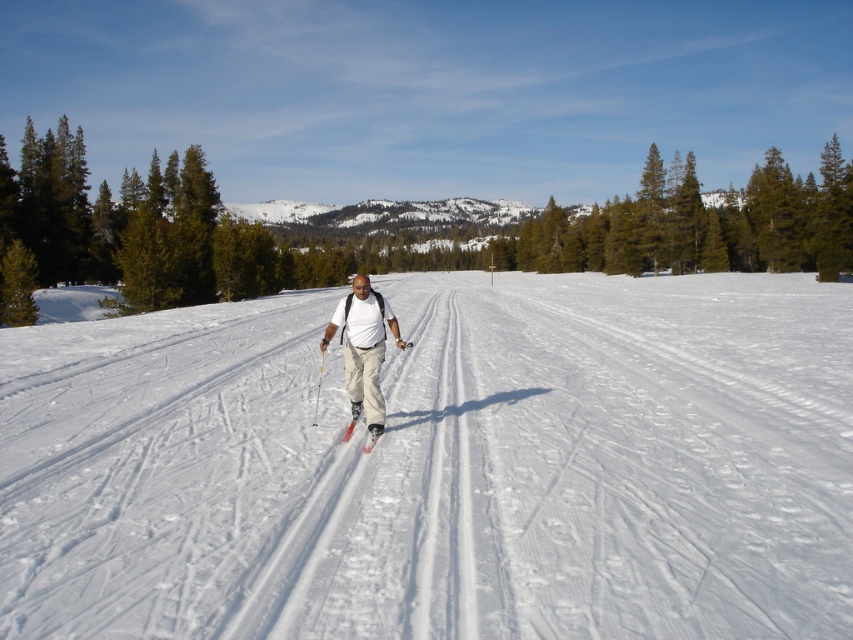
You are standing at the starting point of the cross country skiing trail. You see two points marked on the trail ahead of you. One is at point coordinates point (389, 308) and the other is at point (383, 426). Which point is closer to you?

Point (383, 426) is closer to you because it is less far from the camera than point (389, 308).

You are a photographer standing at the edge of the snow trail. You want to take a photo of the matte white shirt at center. Where should you aim your camera to capture the shirt in the frame?

You should aim your camera at point 0.547 on the horizontal axis and 0.427 on the vertical axis to capture the matte white shirt at center.

You are a photographer trying to capture the skier in the center. The white snow at center and the matte white shirt at center might cause some confusion in the photo. Which one is taller in the image?

The white snow at center is taller than the matte white shirt at center, so the snow will appear taller in the photo.